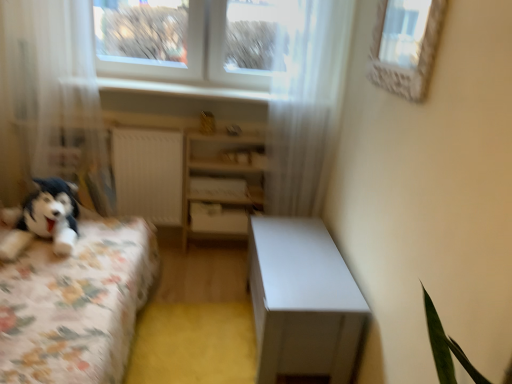
The height and width of the screenshot is (384, 512). I want to click on free space in front of white wood shelf at center, so click(x=212, y=282).